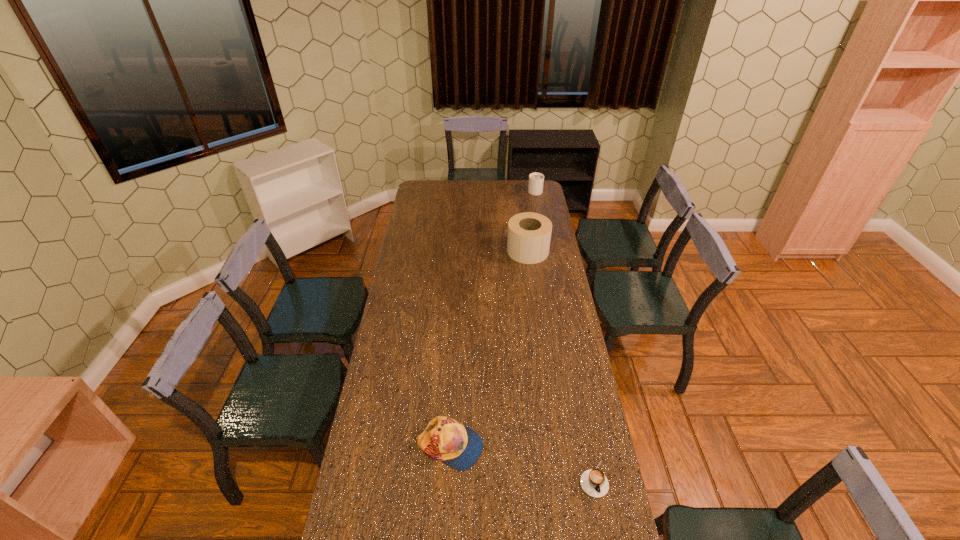
The width and height of the screenshot is (960, 540). What are the coordinates of `blank space located 0.210m on the bill of the third tallest object` in the screenshot? It's located at (543, 447).

I want to click on free location located with the handle on the side of the shorter cappuccino, so click(602, 525).

You are a GUI agent. You are given a task and a screenshot of the screen. Output one action in this format:
    pyautogui.click(x=<x>, y=<y>)
    Task: Click on the object positioned at the far edge
    The width and height of the screenshot is (960, 540).
    Given the screenshot: What is the action you would take?
    pyautogui.click(x=536, y=180)

Identify the location of toilet tissue that is at the right edge. The image size is (960, 540). coord(529,234).

This screenshot has height=540, width=960. I want to click on object that is at the far right corner, so click(536, 180).

In the image, there is a desktop. Where is `blank space at the far edge`? The image size is (960, 540). blank space at the far edge is located at coordinates (455, 197).

In the image, there is a desktop. At what (x,y) coordinates should I click in order to perform the action: click on vacant region at the left edge. Please return your answer as a coordinate pair (x, y). This screenshot has height=540, width=960. Looking at the image, I should click on (397, 266).

I want to click on vacant space at the right edge of the desktop, so click(x=540, y=267).

Where is `free space at the far left corner of the desktop`? free space at the far left corner of the desktop is located at coordinates (426, 189).

This screenshot has height=540, width=960. I want to click on vacant space that is in between the farther cappuccino and the leftmost object, so click(492, 318).